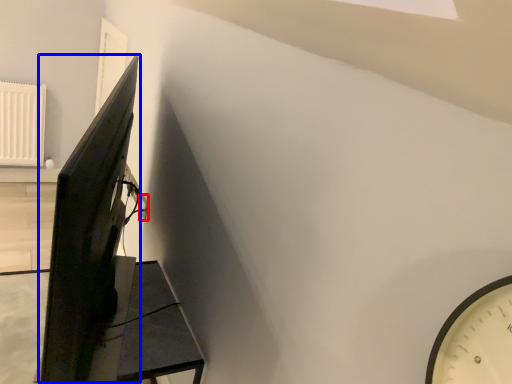
Question: Which of the following is the closest to the observer, electric outlet (highlighted by a red box) or computer monitor (highlighted by a blue box)?

Choices:
 (A) electric outlet
 (B) computer monitor

Answer: (B)